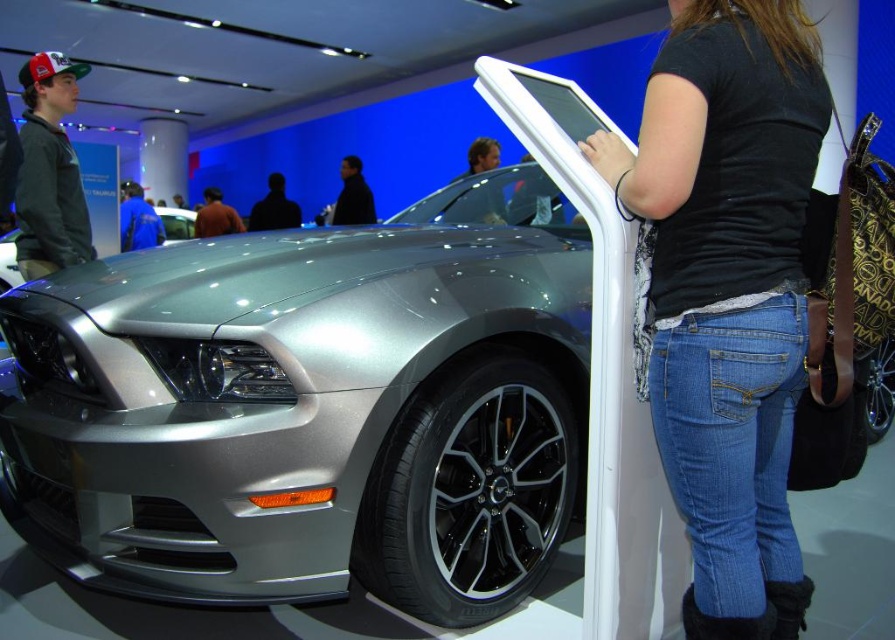
Question: Which object is the closest to the blue fabric shirt at left?

Choices:
 (A) dark blue shirt at center
 (B) black denim jeans at center
 (C) satin silver car at center

Answer: (C)

Question: Is gray hoodie at left closer to the viewer compared to dark blue shirt at center?

Choices:
 (A) yes
 (B) no

Answer: (A)

Question: Is dark matte figure at center thinner than brown sweater at center?

Choices:
 (A) yes
 (B) no

Answer: (B)

Question: Which of the following is the farthest from the observer?

Choices:
 (A) blue denim jeans at lower right
 (B) black denim jeans at center
 (C) satin silver car at center

Answer: (C)

Question: Among these objects, which one is farthest from the camera?

Choices:
 (A) blue fabric shirt at left
 (B) dark blue shirt at center

Answer: (B)

Question: Can you confirm if black denim jeans at center is positioned to the left of dark blue shirt at center?

Choices:
 (A) no
 (B) yes

Answer: (A)